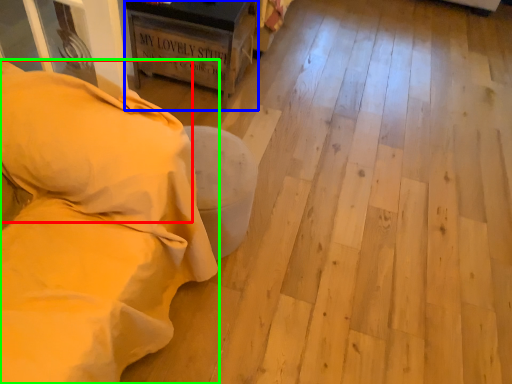
Question: Considering the real-world distances, which object is closest to pillow (highlighted by a red box)? furniture (highlighted by a blue box) or furniture (highlighted by a green box).

Choices:
 (A) furniture
 (B) furniture

Answer: (B)